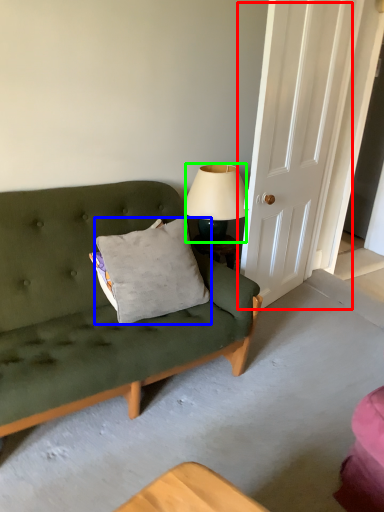
Question: Based on their relative distances, which object is nearer to door (highlighted by a red box)? Choose from pillow (highlighted by a blue box) and lamp (highlighted by a green box).

Choices:
 (A) pillow
 (B) lamp

Answer: (B)